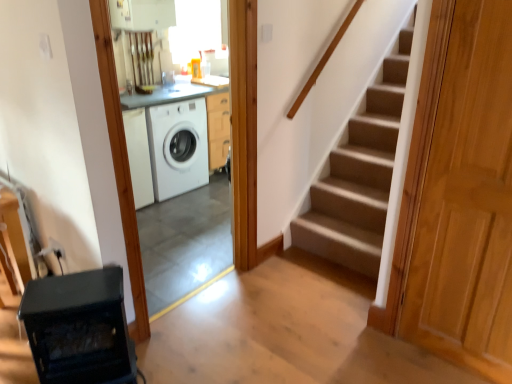
Identify the location of light brown wooden door at right. The height and width of the screenshot is (384, 512). (468, 202).

Where is `white glossy washing machine at center`? Image resolution: width=512 pixels, height=384 pixels. white glossy washing machine at center is located at coordinates (178, 147).

Which of these two, light brown wooden door at right or black glass stove at lower left, stands shorter?

Standing shorter between the two is black glass stove at lower left.

Is black glass stove at lower left located within light brown wooden door at right?

No, black glass stove at lower left is not surrounded by light brown wooden door at right.

Relative to black glass stove at lower left, is light brown wooden door at right in front or behind?

light brown wooden door at right is positioned closer to the viewer than black glass stove at lower left.

From a real-world perspective, who is located higher, white glossy washing machine at center or light brown wooden door at right?

In real-world perspective, light brown wooden door at right is above.

From the image's perspective, is white glossy washing machine at center over light brown wooden door at right?

Indeed, from the image's perspective, white glossy washing machine at center is shown above light brown wooden door at right.

Is white glossy washing machine at center inside the boundaries of light brown wooden door at right, or outside?

The correct answer is: outside.

Consider the image. Does white glossy washing machine at center come behind light brown wooden door at right?

Yes, white glossy washing machine at center is further from the viewer.

From a real-world perspective, which is physically above, white glossy washing machine at center or black glass stove at lower left?

white glossy washing machine at center.

Does white glossy washing machine at center lie in front of black glass stove at lower left?

No, white glossy washing machine at center is further to the viewer.

Does white glossy washing machine at center appear on the left side of black glass stove at lower left?

Incorrect, white glossy washing machine at center is not on the left side of black glass stove at lower left.

Is white glossy washing machine at center with black glass stove at lower left?

There is a gap between white glossy washing machine at center and black glass stove at lower left.

Is light brown wooden door at right at the right side of white glossy washing machine at center?

Yes.

Could you tell me if light brown wooden door at right is facing white glossy washing machine at center?

No, light brown wooden door at right is not oriented towards white glossy washing machine at center.

Is light brown wooden door at right directly adjacent to white glossy washing machine at center?

There is a gap between light brown wooden door at right and white glossy washing machine at center.

Which is more to the right, black glass stove at lower left or white glossy washing machine at center?

Positioned to the right is white glossy washing machine at center.

From the image's perspective, is black glass stove at lower left located above or below white glossy washing machine at center?

From the image's perspective, black glass stove at lower left appears below white glossy washing machine at center.

Does black glass stove at lower left have a lesser height compared to white glossy washing machine at center?

Correct, black glass stove at lower left is not as tall as white glossy washing machine at center.

The height and width of the screenshot is (384, 512). I want to click on appliance below the white glossy washing machine at center (from a real-world perspective), so click(79, 328).

Is white glossy washing machine at center oriented away from black glass stove at lower left?

That's not correct — white glossy washing machine at center is not looking away from black glass stove at lower left.

Considering the relative sizes of white glossy washing machine at center and black glass stove at lower left in the image provided, is white glossy washing machine at center thinner than black glass stove at lower left?

Incorrect, the width of white glossy washing machine at center is not less than that of black glass stove at lower left.

From a real-world perspective, is white glossy washing machine at center positioned above or below black glass stove at lower left?

From a real-world perspective, white glossy washing machine at center is physically above black glass stove at lower left.

From the image's perspective, which is below, black glass stove at lower left or light brown wooden door at right?

black glass stove at lower left.

Based on the photo, can you tell me how much black glass stove at lower left and light brown wooden door at right differ in facing direction?

60.4 degrees.

Is black glass stove at lower left aimed at light brown wooden door at right?

No, black glass stove at lower left is not facing towards light brown wooden door at right.

Would you say black glass stove at lower left is inside or outside light brown wooden door at right?

black glass stove at lower left is not inside light brown wooden door at right, it's outside.

Where is `appliance located below the light brown wooden door at right (from the image's perspective)`? The width and height of the screenshot is (512, 384). appliance located below the light brown wooden door at right (from the image's perspective) is located at coordinates (79, 328).

Where is `door on the right of white glossy washing machine at center`? Image resolution: width=512 pixels, height=384 pixels. door on the right of white glossy washing machine at center is located at coordinates pyautogui.click(x=468, y=202).

From the image, which object appears to be nearer to light brown wooden door at right, black glass stove at lower left or white glossy washing machine at center?

black glass stove at lower left lies closer to light brown wooden door at right than the other object.

When comparing their distances from white glossy washing machine at center, does light brown wooden door at right or white glossy washing machine at center seem closer?

white glossy washing machine at center is closer to white glossy washing machine at center.

From the image, which object appears to be farther from white glossy washing machine at center, light brown wooden door at right or black glass stove at lower left?

The object further to white glossy washing machine at center is light brown wooden door at right.

Estimate the real-world distances between objects in this image. Which object is further from black glass stove at lower left, light brown wooden door at right or white glossy washing machine at center?

Based on the image, white glossy washing machine at center appears to be further to black glass stove at lower left.

Consider the image. Looking at the image, which one is located further to black glass stove at lower left, white glossy washing machine at center or light brown wooden door at right?

white glossy washing machine at center is further to black glass stove at lower left.

Estimate the real-world distances between objects in this image. Which object is further from black glass stove at lower left, white glossy washing machine at center or light brown wooden door at right?

light brown wooden door at right lies further to black glass stove at lower left than the other object.

Looking at the image, which one is located closer to light brown wooden door at right, white glossy washing machine at center or black glass stove at lower left?

black glass stove at lower left lies closer to light brown wooden door at right than the other object.

When comparing their distances from white glossy washing machine at center, does light brown wooden door at right or white glossy washing machine at center seem further?

Based on the image, light brown wooden door at right appears to be further to white glossy washing machine at center.

The height and width of the screenshot is (384, 512). Identify the location of screen door positioned between black glass stove at lower left and white glossy washing machine at center from near to far. (176, 194).

I want to click on screen door between light brown wooden door at right and white glossy washing machine at center in the front-back direction, so click(x=176, y=194).

Find the location of a particular element. This screenshot has height=384, width=512. screen door between black glass stove at lower left and light brown wooden door at right in the horizontal direction is located at coordinates (176, 194).

What are the coordinates of `appliance between light brown wooden door at right and white glossy washing machine at center along the z-axis` in the screenshot? It's located at (79, 328).